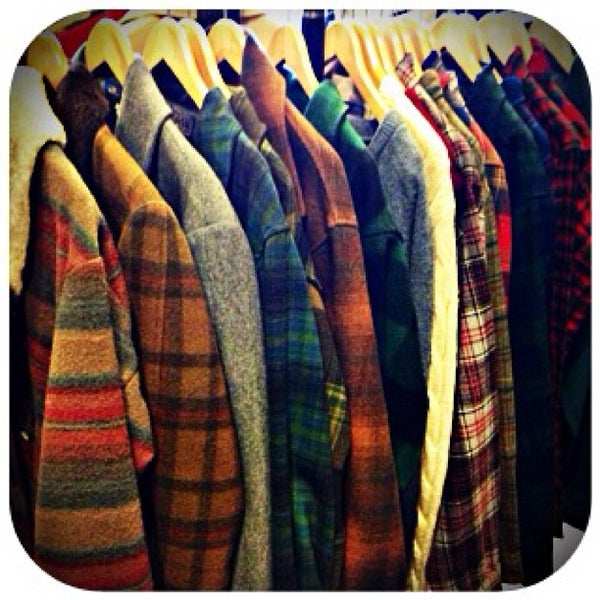
Where is `cloth hanger`? The image size is (600, 600). cloth hanger is located at coordinates (123, 54).